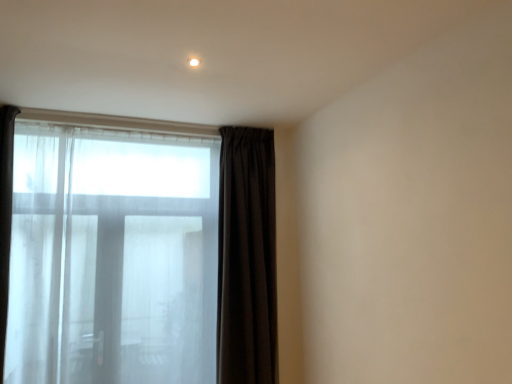
Question: Is transparent fabric bay window at left not close to dark matte curtain at center?

Choices:
 (A) no
 (B) yes

Answer: (A)

Question: Is transparent fabric bay window at left outside of dark matte curtain at center?

Choices:
 (A) yes
 (B) no

Answer: (A)

Question: Is transparent fabric bay window at left aimed at dark matte curtain at center?

Choices:
 (A) yes
 (B) no

Answer: (B)

Question: Does transparent fabric bay window at left have a lesser width compared to dark matte curtain at center?

Choices:
 (A) no
 (B) yes

Answer: (B)

Question: Is transparent fabric bay window at left further to the viewer compared to dark matte curtain at center?

Choices:
 (A) no
 (B) yes

Answer: (A)

Question: Is transparent fabric bay window at left bigger than dark matte curtain at center?

Choices:
 (A) no
 (B) yes

Answer: (B)

Question: Does white glossy light at upper center have a larger size compared to dark matte curtain at center?

Choices:
 (A) no
 (B) yes

Answer: (A)

Question: Could you tell me if white glossy light at upper center is facing dark matte curtain at center?

Choices:
 (A) yes
 (B) no

Answer: (B)

Question: Can you confirm if white glossy light at upper center is positioned to the left of dark matte curtain at center?

Choices:
 (A) yes
 (B) no

Answer: (A)

Question: From the image's perspective, is white glossy light at upper center under dark matte curtain at center?

Choices:
 (A) no
 (B) yes

Answer: (A)

Question: Is dark matte curtain at center surrounded by white glossy light at upper center?

Choices:
 (A) no
 (B) yes

Answer: (A)

Question: From a real-world perspective, is white glossy light at upper center below dark matte curtain at center?

Choices:
 (A) no
 (B) yes

Answer: (A)

Question: Considering the relative sizes of dark matte curtain at center and white glossy light at upper center in the image provided, is dark matte curtain at center thinner than white glossy light at upper center?

Choices:
 (A) no
 (B) yes

Answer: (A)